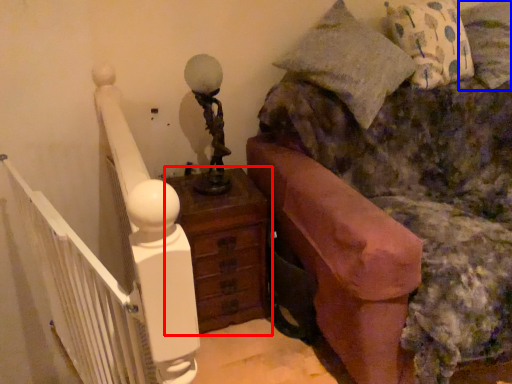
Question: Which of the following is the closest to the observer, nightstand (highlighted by a red box) or pillow (highlighted by a blue box)?

Choices:
 (A) nightstand
 (B) pillow

Answer: (A)